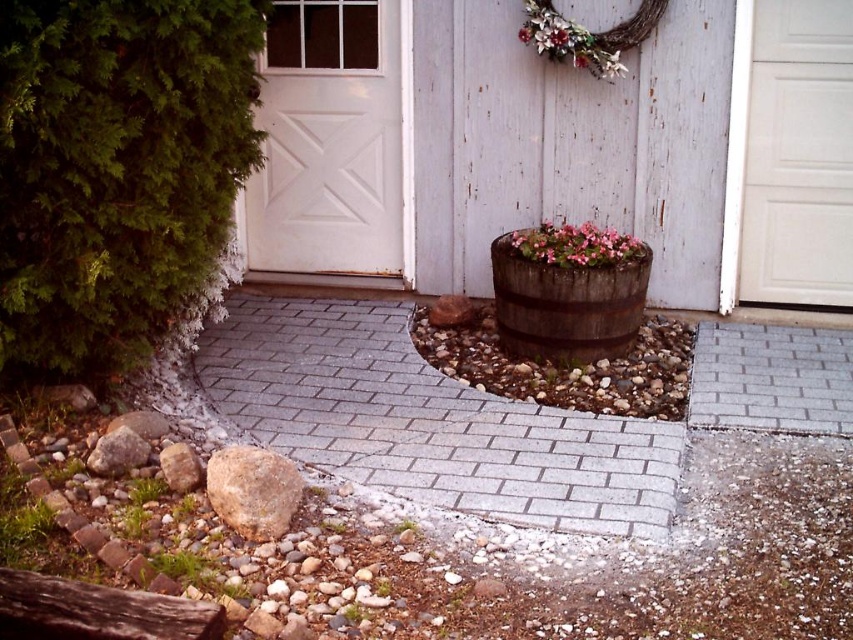
Who is higher up, wooden wreath at upper center or green leafy plant at lower center?

Positioned higher is wooden wreath at upper center.

Does wooden wreath at upper center appear on the left side of green leafy plant at lower center?

In fact, wooden wreath at upper center is to the right of green leafy plant at lower center.

This screenshot has height=640, width=853. What do you see at coordinates (567, 40) in the screenshot?
I see `wooden wreath at upper center` at bounding box center [567, 40].

Where is `wooden wreath at upper center`? Image resolution: width=853 pixels, height=640 pixels. wooden wreath at upper center is located at coordinates (567, 40).

Does green leafy bush at left have a smaller size compared to green leafy plant at lower center?

Actually, green leafy bush at left might be larger than green leafy plant at lower center.

This screenshot has width=853, height=640. I want to click on green leafy bush at left, so click(x=115, y=170).

Which is in front, point (786, 209) or point (604, 74)?

Point (604, 74)

Who is taller, white matte door at right or wooden wreath at upper center?

With more height is white matte door at right.

Who is more distant from viewer, (779, 172) or (543, 12)?

The point (779, 172) is more distant.

Identify the location of white matte door at right. (798, 156).